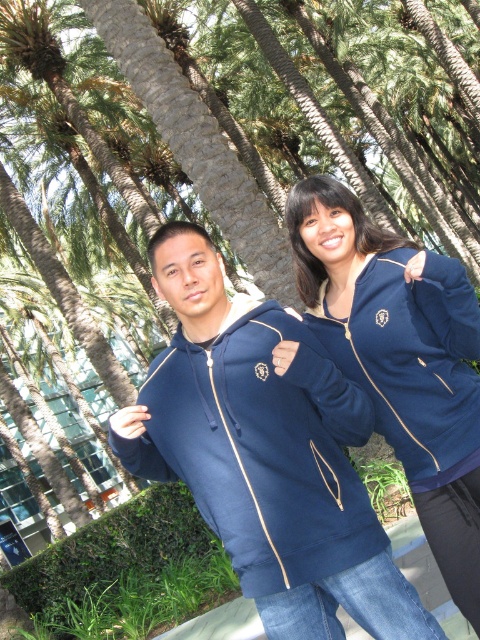
Looking at this image, you are standing in front of a photo of two people wearing navy blue hooded sweatshirts. The photo includes a matte blue sweatshirt at center. If you want to see the sweatshirt more clearly, should you move closer or farther away from the photo?

The matte blue sweatshirt at center is 6.38 feet away from the viewer. To see it more clearly, you should move closer to the photo because reducing the distance would allow for a clearer view.

You are a photographer trying to capture a clear shot of the navy blue hoodie at center and the navy blue fleece sweatshirt at upper right. Which item is more likely to be obscured by the other in the photo?

The navy blue fleece sweatshirt at upper right is behind the navy blue hoodie at center, so it is more likely to be obscured by the hoodie in the photo.